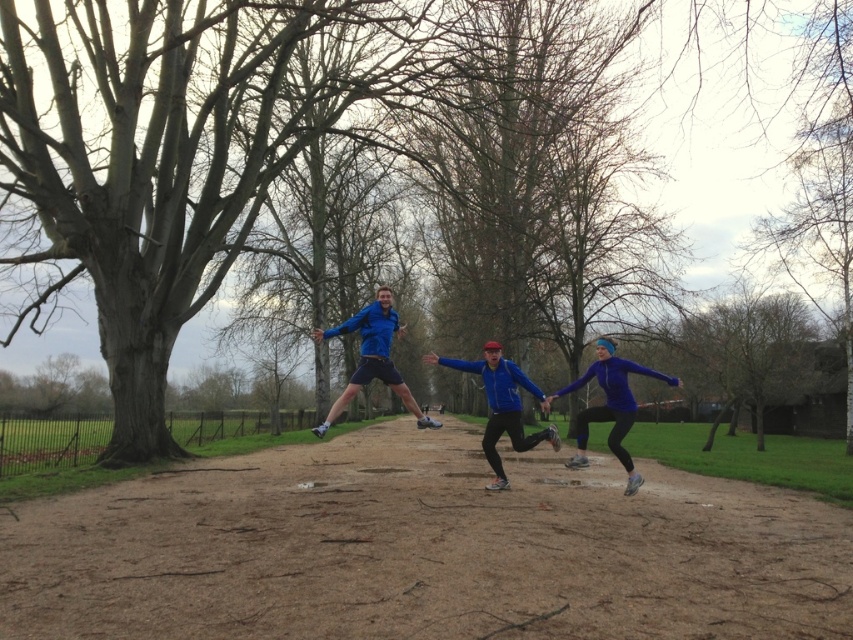
Is brown dirt path at center smaller than matte blue jacket at lower right?

No.

Is brown dirt path at center wider than matte blue jacket at lower right?

Yes.

The height and width of the screenshot is (640, 853). I want to click on brown dirt path at center, so click(x=422, y=550).

Image resolution: width=853 pixels, height=640 pixels. I want to click on brown dirt path at center, so coord(422,550).

Which of these two, blue fabric jacket at center or blue matte jacket at center, stands shorter?

blue fabric jacket at center

In the scene shown: Is blue fabric jacket at center below blue matte jacket at center?

Correct, blue fabric jacket at center is located below blue matte jacket at center.

Is point (515, 376) farther from viewer compared to point (317, 330)?

No.

Locate an element on the screen. The width and height of the screenshot is (853, 640). blue fabric jacket at center is located at coordinates (502, 404).

Does brown bark tree at center have a smaller size compared to blue matte jacket at center?

Actually, brown bark tree at center might be larger than blue matte jacket at center.

Which is in front, point (158, 273) or point (378, 330)?

Positioned in front is point (378, 330).

Looking at this image, who is more forward, (144,436) or (390,333)?

Point (390,333)

Identify the location of brown bark tree at center. (193, 147).